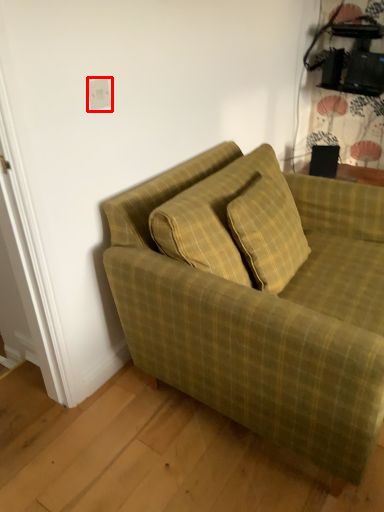
Question: From the image's perspective, what is the correct spatial relationship of electric outlet (annotated by the red box) in relation to studio couch?

Choices:
 (A) below
 (B) above

Answer: (B)